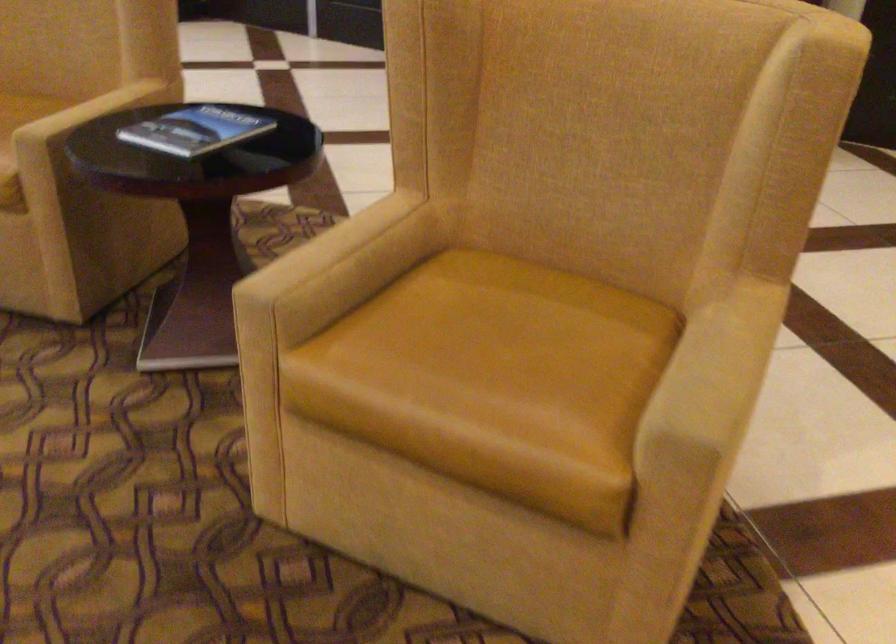
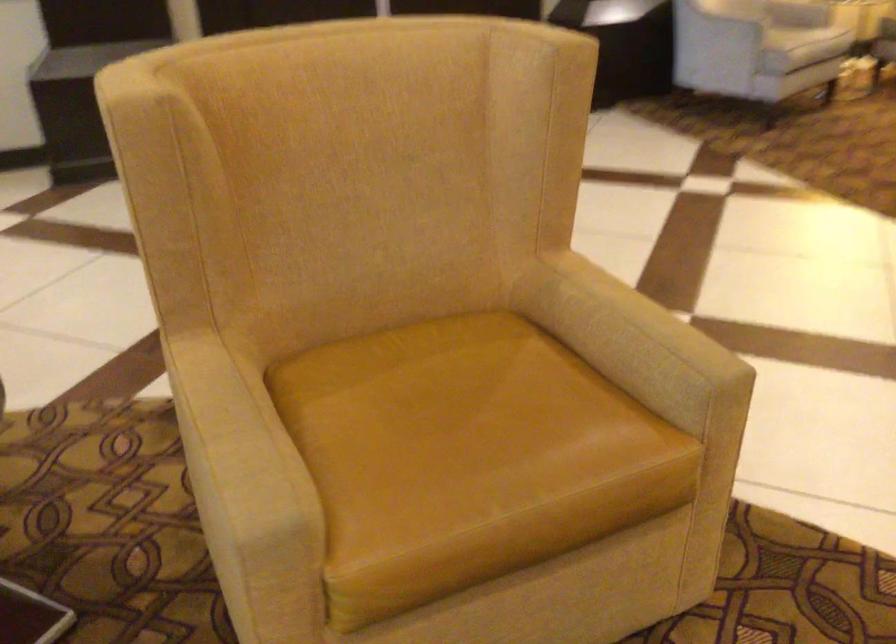
The point at (709,346) is marked in the first image. Where is the corresponding point in the second image?

(624, 322)